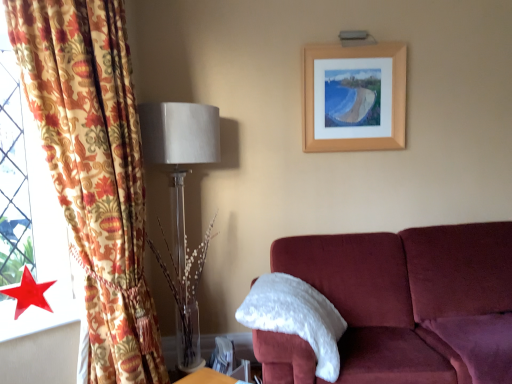
Question: From a real-world perspective, is wooden picture frame at upper center located beneath white fluffy pillow at right?

Choices:
 (A) yes
 (B) no

Answer: (B)

Question: Is wooden picture frame at upper center wider than white fluffy pillow at right?

Choices:
 (A) yes
 (B) no

Answer: (B)

Question: From the image's perspective, is wooden picture frame at upper center below white fluffy pillow at right?

Choices:
 (A) no
 (B) yes

Answer: (A)

Question: Are wooden picture frame at upper center and white fluffy pillow at right beside each other?

Choices:
 (A) no
 (B) yes

Answer: (A)

Question: Would you say white fluffy pillow at right is part of wooden picture frame at upper center's contents?

Choices:
 (A) yes
 (B) no

Answer: (B)

Question: From a real-world perspective, does wooden picture frame at upper center stand above white fluffy pillow at right?

Choices:
 (A) yes
 (B) no

Answer: (A)

Question: Can you confirm if translucent glass vase at left is positioned to the right of wooden picture frame at upper center?

Choices:
 (A) yes
 (B) no

Answer: (B)

Question: From a real-world perspective, is translucent glass vase at left located beneath wooden picture frame at upper center?

Choices:
 (A) no
 (B) yes

Answer: (B)

Question: Can you confirm if translucent glass vase at left is taller than wooden picture frame at upper center?

Choices:
 (A) yes
 (B) no

Answer: (A)

Question: Is translucent glass vase at left positioned beyond the bounds of wooden picture frame at upper center?

Choices:
 (A) no
 (B) yes

Answer: (B)

Question: Would you say translucent glass vase at left contains wooden picture frame at upper center?

Choices:
 (A) yes
 (B) no

Answer: (B)

Question: Is translucent glass vase at left facing away from wooden picture frame at upper center?

Choices:
 (A) yes
 (B) no

Answer: (B)

Question: Is floral fabric curtain at left facing towards wooden picture frame at upper center?

Choices:
 (A) yes
 (B) no

Answer: (B)